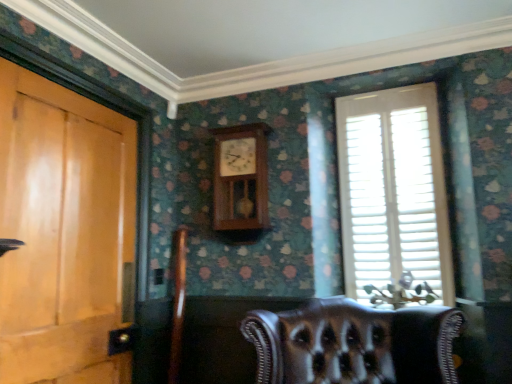
Question: Does point (409, 180) appear closer or farther from the camera than point (45, 339)?

Choices:
 (A) farther
 (B) closer

Answer: (A)

Question: Based on their sizes in the image, would you say white wood blinds at right is bigger or smaller than light brown wood door at left?

Choices:
 (A) small
 (B) big

Answer: (A)

Question: Estimate the real-world distances between objects in this image. Which object is farther from the light brown wood door at left?

Choices:
 (A) leather chair at lower center
 (B) wooden clock at center
 (C) white wood blinds at right

Answer: (C)

Question: Considering the real-world distances, which object is farthest from the leather chair at lower center?

Choices:
 (A) light brown wood door at left
 (B) white wood blinds at right
 (C) wooden clock at center

Answer: (A)